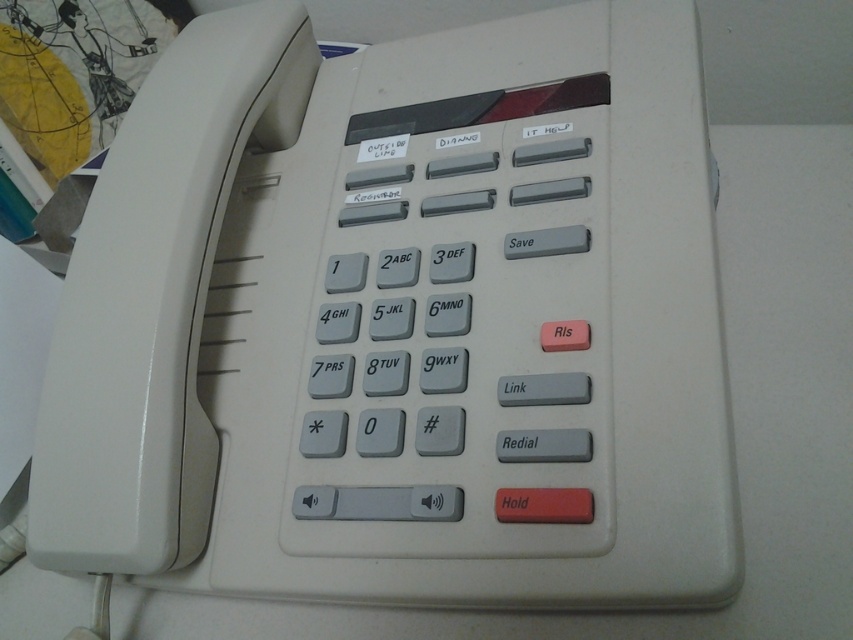
You are looking at the office telephone and need to press two points on it. The first point is at coordinate point [585,497] and the second is at point [456,268]. Which point is closer to you when you are facing the phone?

Point [585,497] is closer to the viewer than point [456,268].

You are using the office telephone and need to press the closest button to your hand. Which button should you press between the matte red button at center and the matte gray key at center?

The matte red button at center is closer to the viewer than the matte gray key at center, so you should press the matte red button at center.

You are trying to locate the Hold button on the beige office telephone. The matte red button at center and the matte gray key at center are both on the keypad. Which one is positioned lower?

The matte red button at center is located below the matte gray key at center, so the matte red button at center is positioned lower.